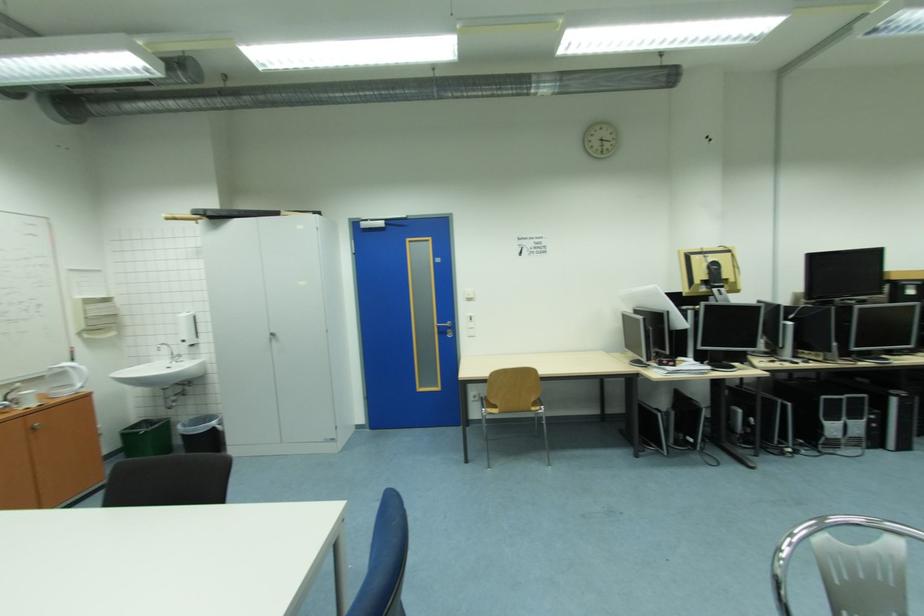
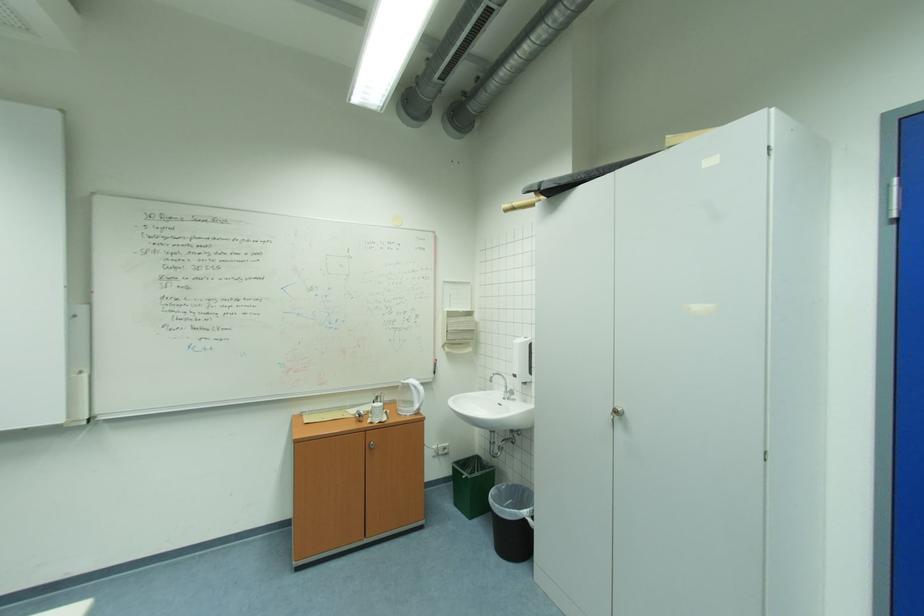
The point at [189,342] is marked in the first image. Where is the corresponding point in the second image?

(523, 377)